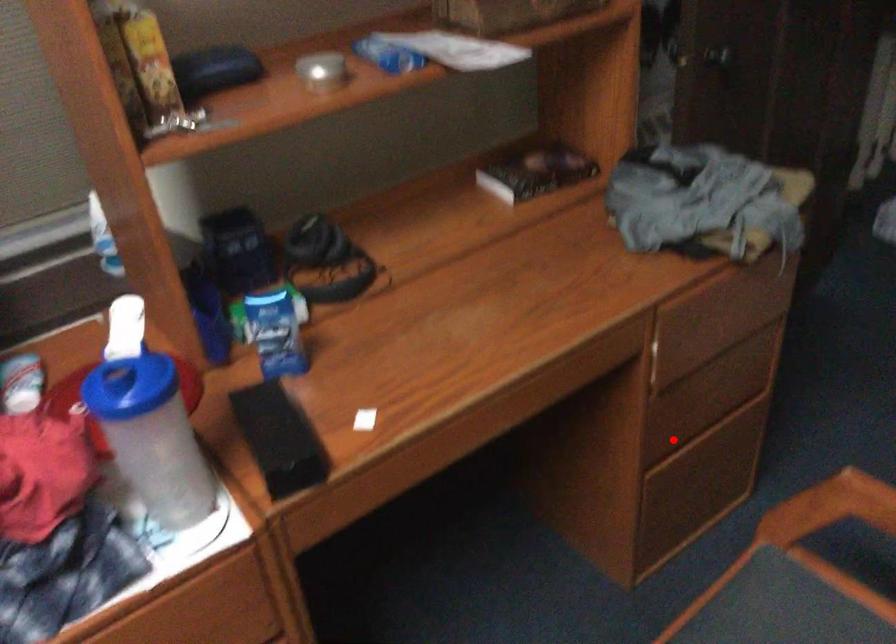
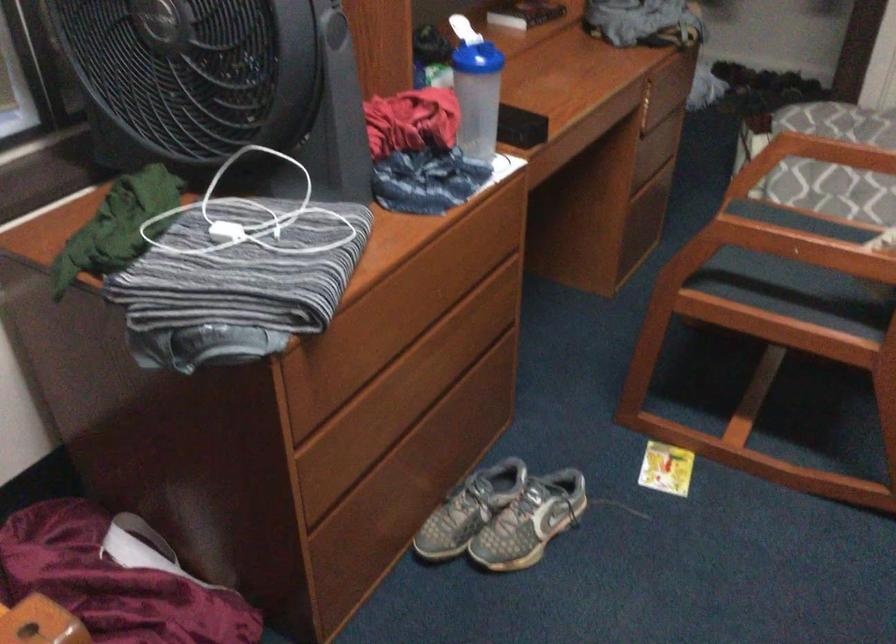
Find the pixel in the second image that matches the highlighted location in the first image.

(643, 169)